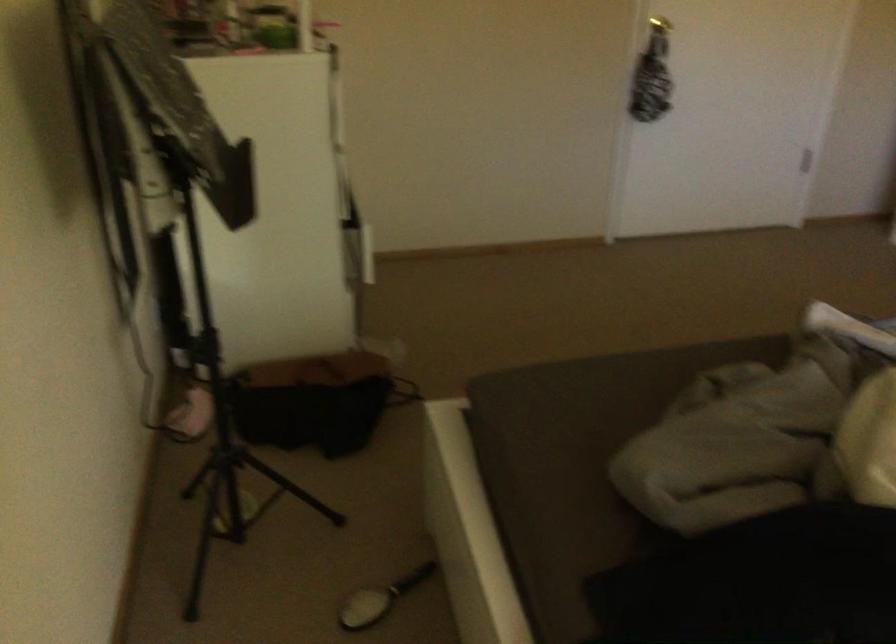
Identify the location of gold door knob. (659, 24).